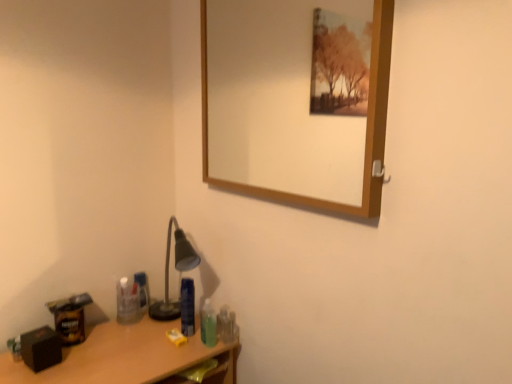
The height and width of the screenshot is (384, 512). I want to click on free spot to the left of translucent plastic bottle at lower center, which appears as the 2th toiletry when viewed from the right, so click(154, 342).